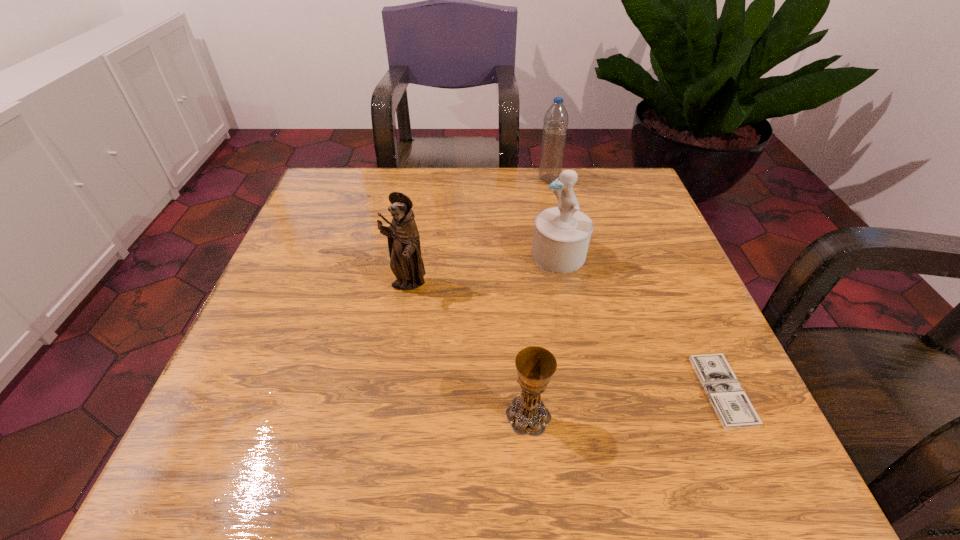
Locate an element on the screen. The image size is (960, 540). free point between the chalice and the water bottle is located at coordinates (539, 297).

Find the location of a particular element. free point between the rightmost object and the right figurine is located at coordinates (640, 322).

This screenshot has height=540, width=960. I want to click on blank region between the dollar and the right figurine, so click(640, 322).

Image resolution: width=960 pixels, height=540 pixels. I want to click on empty location between the dollar and the chalice, so click(x=625, y=403).

Find the location of a particular element. This screenshot has height=540, width=960. the fourth closest object relative to the farthest object is located at coordinates (527, 414).

The width and height of the screenshot is (960, 540). I want to click on object that is the fourth closest to the chalice, so click(555, 126).

Where is `free space that satisfies the following two spatial constraints: 1. on the back side of the rightmost object; 2. on the left side of the chalice`? The image size is (960, 540). free space that satisfies the following two spatial constraints: 1. on the back side of the rightmost object; 2. on the left side of the chalice is located at coordinates (526, 390).

Identify the location of free space that satisfies the following two spatial constraints: 1. on the front side of the farthest object; 2. at the beak of the right figurine. Image resolution: width=960 pixels, height=540 pixels. (564, 255).

Where is `free point that satisfies the following two spatial constraints: 1. on the back side of the water bottle; 2. on the left side of the chalice`? The image size is (960, 540). free point that satisfies the following two spatial constraints: 1. on the back side of the water bottle; 2. on the left side of the chalice is located at coordinates (508, 179).

Where is `vacant space that satisfies the following two spatial constraints: 1. on the back side of the dollar; 2. at the beak of the right figurine`? vacant space that satisfies the following two spatial constraints: 1. on the back side of the dollar; 2. at the beak of the right figurine is located at coordinates (661, 255).